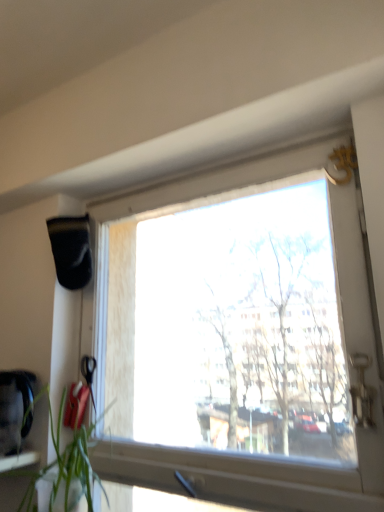
At what (x,y) coordinates should I click in order to perform the action: click on green leafy plant at lower left. Please return your answer as a coordinate pair (x, y). Looking at the image, I should click on (62, 463).

The width and height of the screenshot is (384, 512). What do you see at coordinates (62, 463) in the screenshot?
I see `green leafy plant at lower left` at bounding box center [62, 463].

This screenshot has height=512, width=384. I want to click on transparent glass window at center, so click(238, 337).

The height and width of the screenshot is (512, 384). What do you see at coordinates (238, 337) in the screenshot? I see `transparent glass window at center` at bounding box center [238, 337].

What is the approximate width of transparent glass window at center?

transparent glass window at center is 3.25 inches in width.

Image resolution: width=384 pixels, height=512 pixels. Find the location of `green leafy plant at lower left`. green leafy plant at lower left is located at coordinates (62, 463).

Considering the positions of objects green leafy plant at lower left and transparent glass window at center in the image provided, who is more to the left, green leafy plant at lower left or transparent glass window at center?

green leafy plant at lower left is more to the left.

Does green leafy plant at lower left lie behind transparent glass window at center?

No, it is in front of transparent glass window at center.

Is point (23, 496) positioned in front of point (287, 357)?

No, it is behind (287, 357).

From the image's perspective, between green leafy plant at lower left and transparent glass window at center, which one is located above?

transparent glass window at center, from the image's perspective.

From a real-world perspective, is green leafy plant at lower left above or below transparent glass window at center?

green leafy plant at lower left is below transparent glass window at center.

Considering the sizes of objects green leafy plant at lower left and transparent glass window at center in the image provided, who is wider, green leafy plant at lower left or transparent glass window at center?

green leafy plant at lower left.

Considering the relative sizes of green leafy plant at lower left and transparent glass window at center in the image provided, is green leafy plant at lower left taller than transparent glass window at center?

Incorrect, the height of green leafy plant at lower left is not larger of that of transparent glass window at center.

In terms of size, does green leafy plant at lower left appear bigger or smaller than transparent glass window at center?

green leafy plant at lower left is smaller than transparent glass window at center.

Would you say green leafy plant at lower left is inside or outside transparent glass window at center?

green leafy plant at lower left is located beyond the bounds of transparent glass window at center.

Looking at this image, is green leafy plant at lower left next to transparent glass window at center?

No, green leafy plant at lower left is not touching transparent glass window at center.

Could you tell me if green leafy plant at lower left is facing transparent glass window at center?

→ No, green leafy plant at lower left is not oriented towards transparent glass window at center.

This screenshot has width=384, height=512. What are the coordinates of `window lying behind the green leafy plant at lower left` in the screenshot? It's located at (238, 337).

Is transparent glass window at center to the left of green leafy plant at lower left from the viewer's perspective?

Incorrect, transparent glass window at center is not on the left side of green leafy plant at lower left.

Relative to green leafy plant at lower left, is transparent glass window at center in front or behind?

Clearly, transparent glass window at center is behind green leafy plant at lower left.

Does point (333, 340) come behind point (23, 504)?

No, (333, 340) is in front of (23, 504).

From the image's perspective, which is below, transparent glass window at center or green leafy plant at lower left?

green leafy plant at lower left is shown below in the image.

From a real-world perspective, which object stands above the other?

transparent glass window at center.

Is transparent glass window at center thinner than green leafy plant at lower left?

Indeed, transparent glass window at center has a lesser width compared to green leafy plant at lower left.

Considering the relative sizes of transparent glass window at center and green leafy plant at lower left in the image provided, is transparent glass window at center shorter than green leafy plant at lower left?

Incorrect, the height of transparent glass window at center does not fall short of that of green leafy plant at lower left.

Is transparent glass window at center bigger or smaller than green leafy plant at lower left?

Considering their sizes, transparent glass window at center takes up more space than green leafy plant at lower left.

Would you say green leafy plant at lower left is part of transparent glass window at center's contents?

No, green leafy plant at lower left is not a part of transparent glass window at center.

Is there a large distance between transparent glass window at center and green leafy plant at lower left?

No.

Is green leafy plant at lower left at the back of transparent glass window at center?

Yes.

I want to click on houseplant below the transparent glass window at center (from the image's perspective), so click(62, 463).

Locate an element on the screen. houseplant that appears below the transparent glass window at center (from the image's perspective) is located at coordinates (62, 463).

Locate an element on the screen. Image resolution: width=384 pixels, height=512 pixels. window lying behind the green leafy plant at lower left is located at coordinates (238, 337).